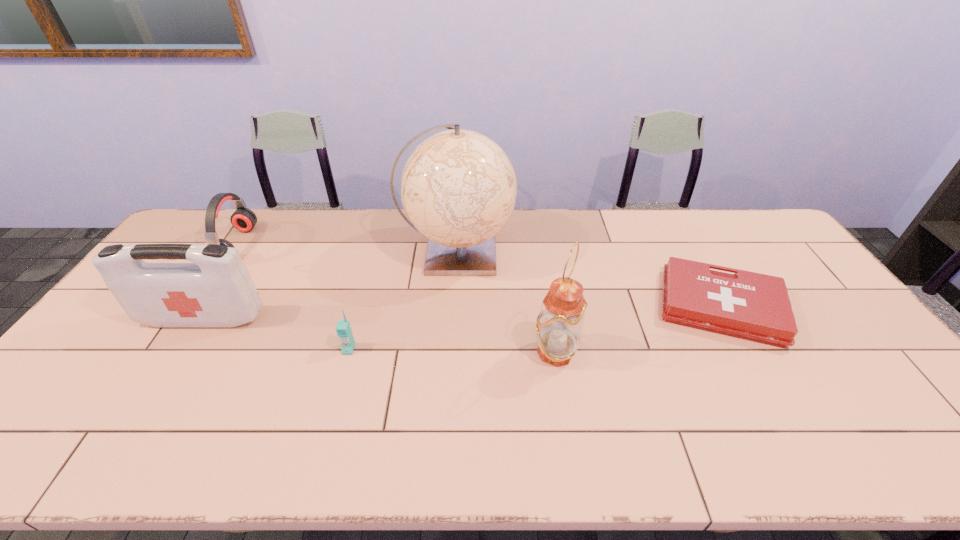
You are a GUI agent. You are given a task and a screenshot of the screen. Output one action in this format:
    pyautogui.click(x=<x>, y=<y>)
    Task: Click on the free space between the rightmost object and the third tallest object
    The width and height of the screenshot is (960, 540).
    Given the screenshot: What is the action you would take?
    pyautogui.click(x=462, y=313)

The image size is (960, 540). I want to click on vacant space that is in between the oil lamp and the fourth object from right to left, so click(x=452, y=350).

The height and width of the screenshot is (540, 960). Identify the location of free space between the cellular telephone and the earphone. (293, 297).

Locate an element on the screen. The width and height of the screenshot is (960, 540). blank region between the oil lamp and the shortest object is located at coordinates (637, 329).

I want to click on the third closest object to the fourth shortest object, so click(458, 187).

The image size is (960, 540). I want to click on object that can be found as the closest to the fifth tallest object, so click(458, 187).

Locate an element on the screen. This screenshot has height=540, width=960. free space that satisfies the following two spatial constraints: 1. on the keypad of the cellular telephone; 2. on the right side of the oil lamp is located at coordinates (348, 352).

At what (x,y) coordinates should I click in order to perform the action: click on blank space that satisfies the following two spatial constraints: 1. on the keypad of the cellular telephone; 2. on the left side of the second object from right to left. Please return your answer as a coordinate pair (x, y). Looking at the image, I should click on (348, 352).

At what (x,y) coordinates should I click in order to perform the action: click on free space that satisfies the following two spatial constraints: 1. on the surface of the fourth object from left to right showing Europe and Africa; 2. on the back side of the rightmost object. Please return your answer as a coordinate pair (x, y). Looking at the image, I should click on (454, 307).

I want to click on vacant space that satisfies the following two spatial constraints: 1. on the surface of the tallest object showing Europe and Africa; 2. on the front side of the third tallest object, so click(453, 318).